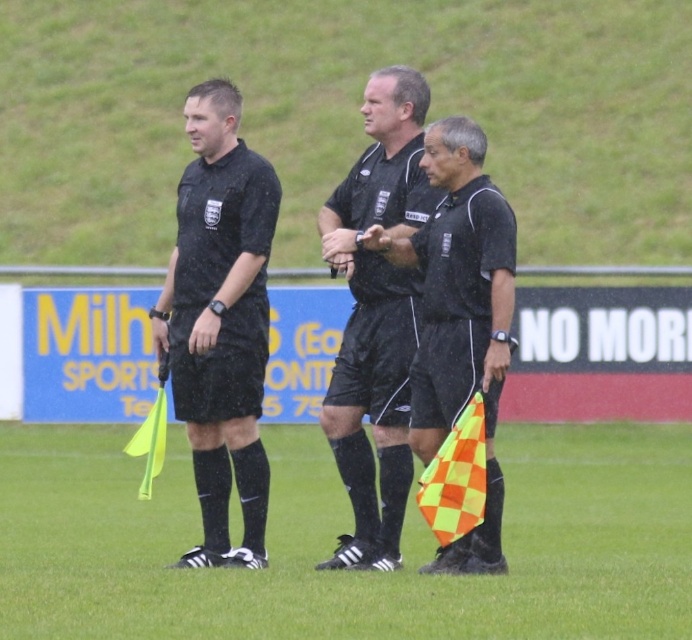
You are a spectator at a sports event and see the black matte referee at center and the matte black flag at center. Which object appears taller in the image?

The matte black flag at center appears taller than the black matte referee at center because the referee is not as tall as the flag.

You are a photographer at the edge of the field. You want to take a photo of the black matte referee at center and the matte black flag at center such that the referee is to the right of the flag in the photo. Is this possible based on their current positions?

The black matte referee at center is positioned on the left side of the matte black flag at center, so in the photo, the referee would appear to the left of the flag, making it impossible to have the referee to the right as desired.